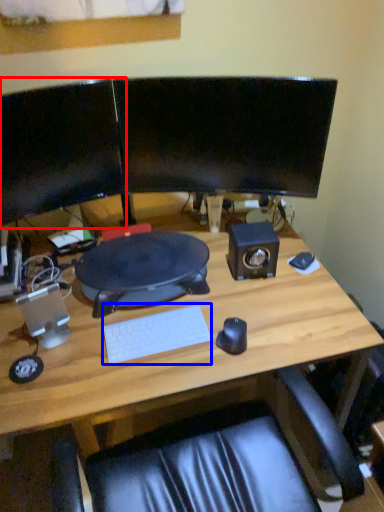
Question: Which of the following is the farthest to the observer, computer monitor (highlighted by a red box) or computer keyboard (highlighted by a blue box)?

Choices:
 (A) computer monitor
 (B) computer keyboard

Answer: (B)